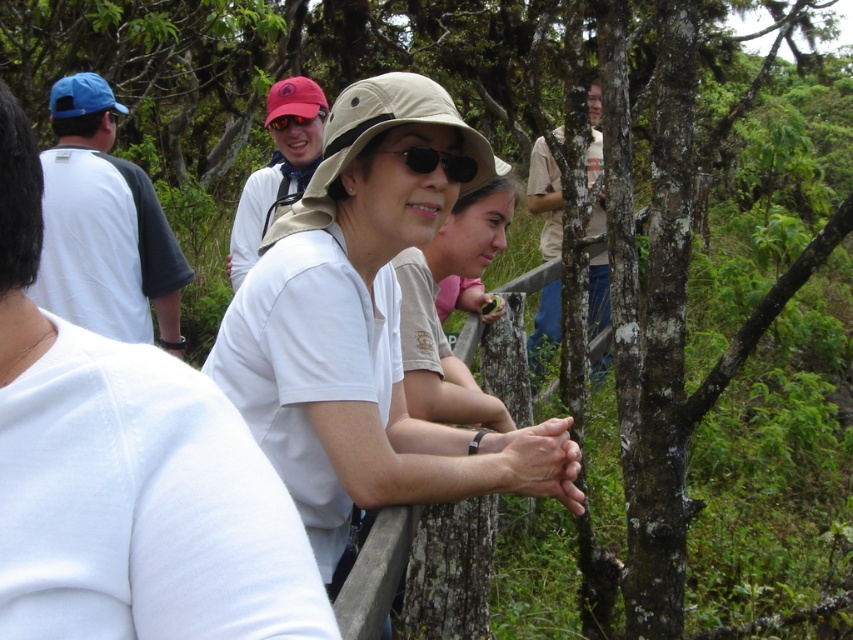
Question: Which of the following is the farthest from the observer?

Choices:
 (A) white matte shirt at upper center
 (B) red matte sunglasses at upper center
 (C) white cotton shirt at left

Answer: (B)

Question: Which point is farther to the camera?

Choices:
 (A) white matte shirt at upper center
 (B) matte white shirt at upper center

Answer: (B)

Question: Does white cotton shirt at left appear under black matte sunglasses at center?

Choices:
 (A) yes
 (B) no

Answer: (B)

Question: Does white matte shirt at upper center have a smaller size compared to white cotton shirt at left?

Choices:
 (A) no
 (B) yes

Answer: (B)

Question: Among these objects, which one is nearest to the camera?

Choices:
 (A) black matte sunglasses at center
 (B) white cotton shirt at left

Answer: (A)

Question: Is white matte shirt at upper center closer to the viewer compared to light brown t-shirt at upper right?

Choices:
 (A) yes
 (B) no

Answer: (A)